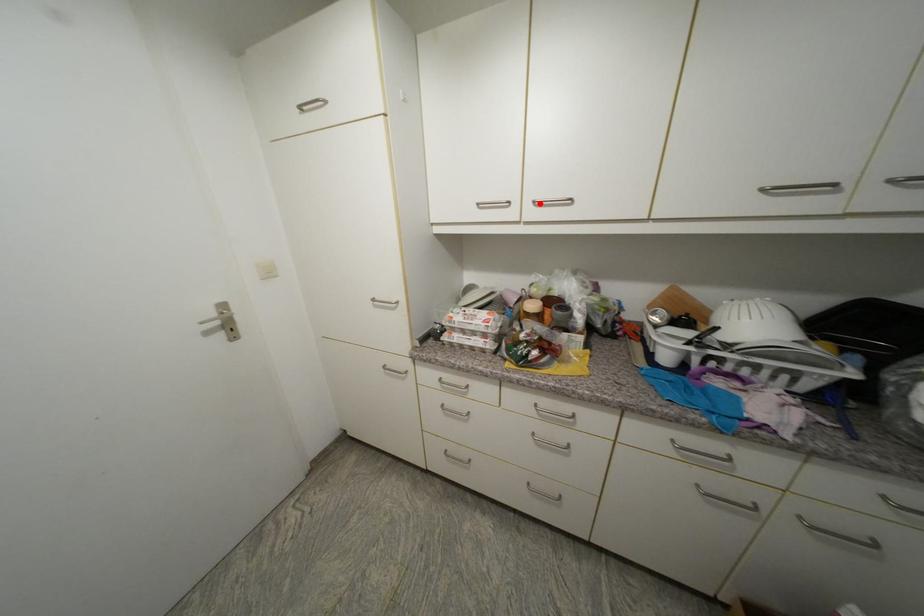
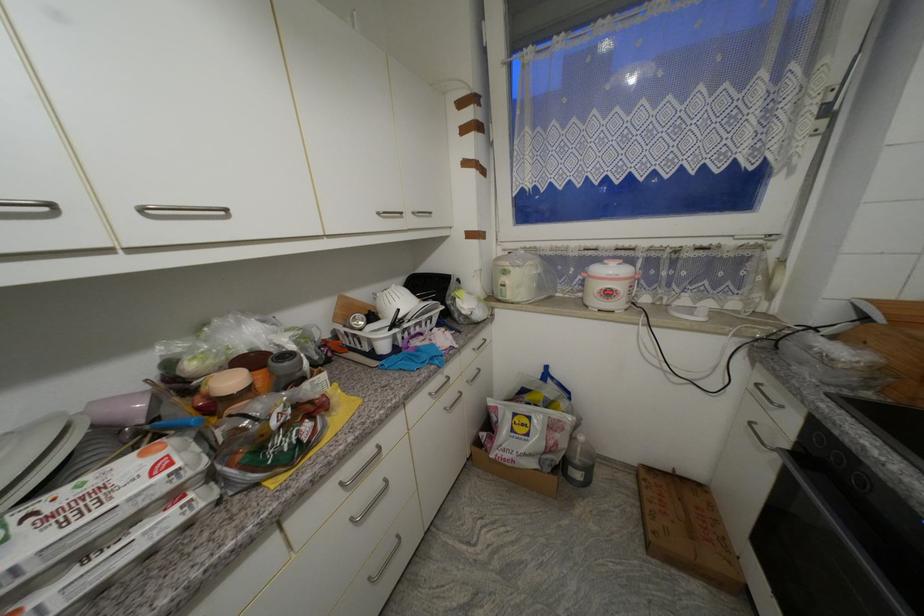
Where in the second image is the point corresponding to the highlighted location from the first image?

(149, 211)